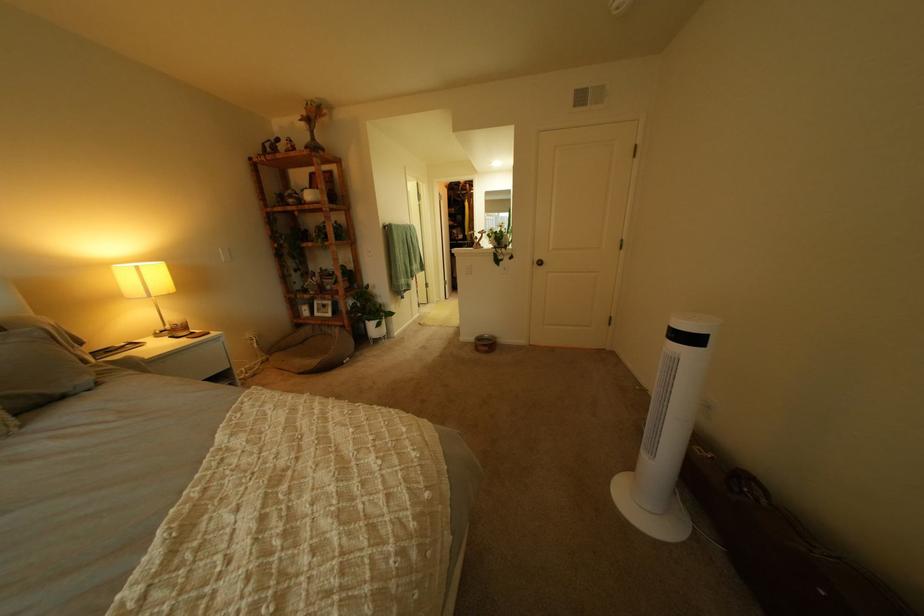
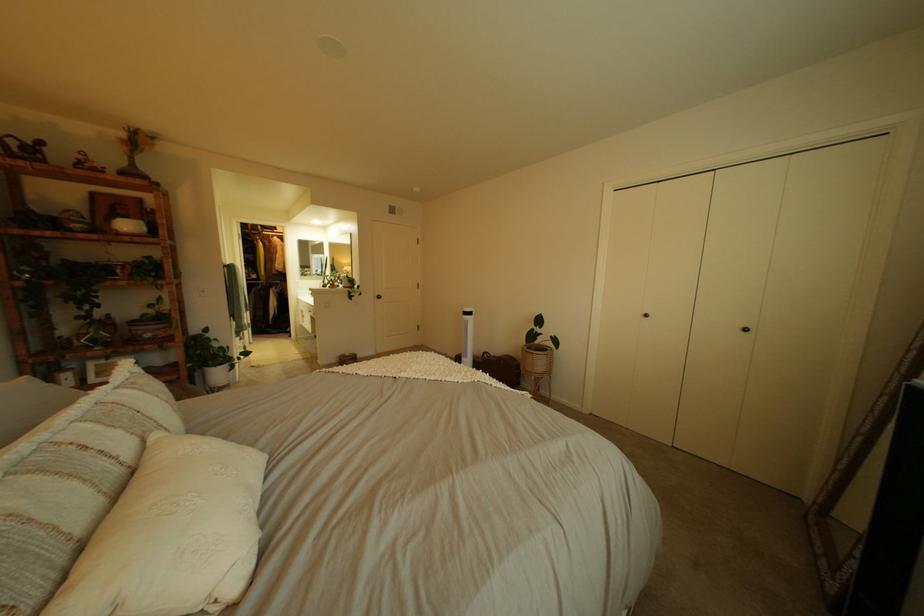
Find the pixel in the second image that matches [320,114] in the first image.

(139, 137)